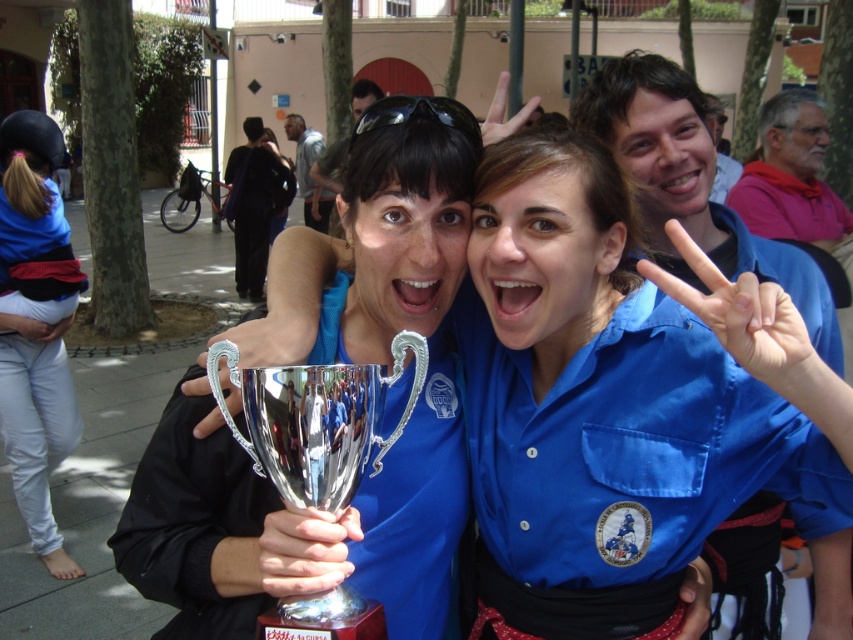
Does metallic trophy at center lie in front of blue denim pants at lower left?

Yes.

Which is above, metallic trophy at center or blue denim pants at lower left?

blue denim pants at lower left is higher up.

Where is `metallic trophy at center`? The image size is (853, 640). metallic trophy at center is located at coordinates (532, 312).

Who is positioned more to the left, blue denim pants at lower left or black fabric jacket at center?

black fabric jacket at center

Does point (39, 221) lie in front of point (236, 154)?

Yes, point (39, 221) is in front of point (236, 154).

Locate an element on the screen. This screenshot has height=640, width=853. blue denim pants at lower left is located at coordinates (35, 324).

Is point (842, 413) positioned behind point (305, 611)?

No, (842, 413) is closer to viewer.

Which is behind, point (735, 355) or point (257, 372)?

Point (257, 372)

Locate an element on the screen. This screenshot has height=640, width=853. metallic trophy at center is located at coordinates (532, 312).